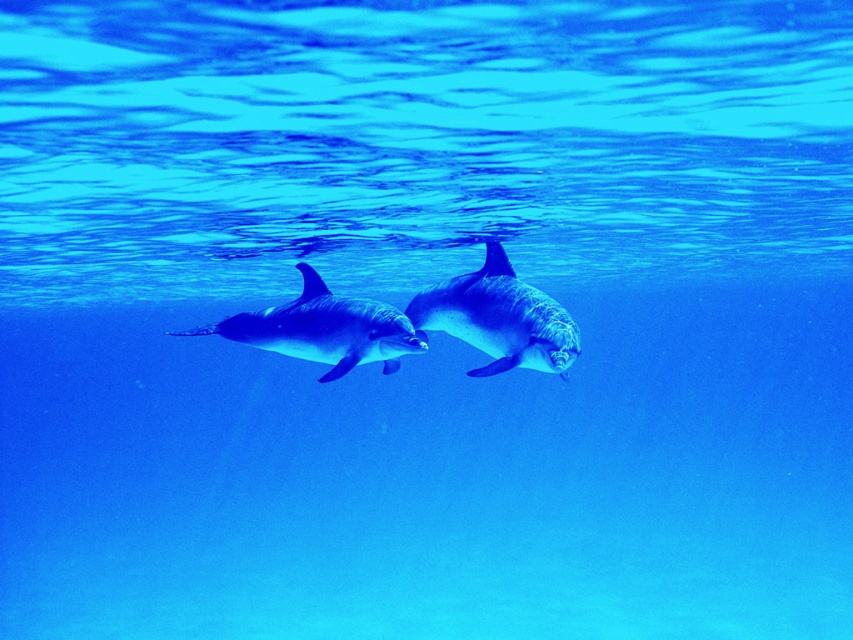
Question: Is glossy dolphin at center to the left of smooth gray dolphin at center from the viewer's perspective?

Choices:
 (A) no
 (B) yes

Answer: (A)

Question: Is glossy dolphin at center to the right of smooth gray dolphin at center from the viewer's perspective?

Choices:
 (A) no
 (B) yes

Answer: (B)

Question: Is glossy dolphin at center bigger than smooth gray dolphin at center?

Choices:
 (A) no
 (B) yes

Answer: (A)